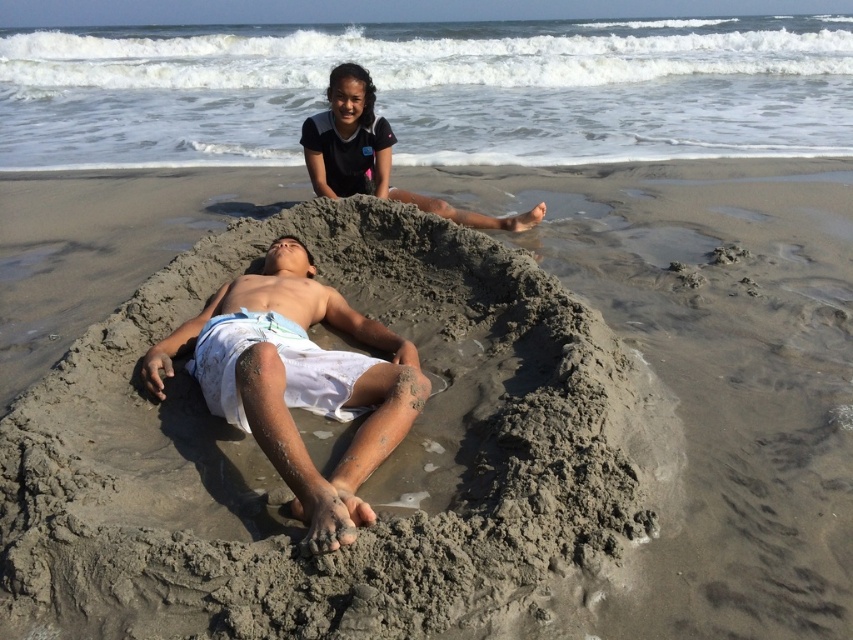
Question: Does white sand man at center have a greater width compared to dark blue fabric at upper center?

Choices:
 (A) no
 (B) yes

Answer: (A)

Question: Among these points, which one is nearest to the camera?

Choices:
 (A) (370, 113)
 (B) (360, 332)

Answer: (B)

Question: Where is white sand man at center located in relation to dark blue fabric at upper center in the image?

Choices:
 (A) below
 (B) above

Answer: (A)

Question: Is white sand man at center positioned behind dark blue fabric at upper center?

Choices:
 (A) no
 (B) yes

Answer: (A)

Question: Which of the following is the farthest from the observer?

Choices:
 (A) (527, 211)
 (B) (235, 365)

Answer: (A)